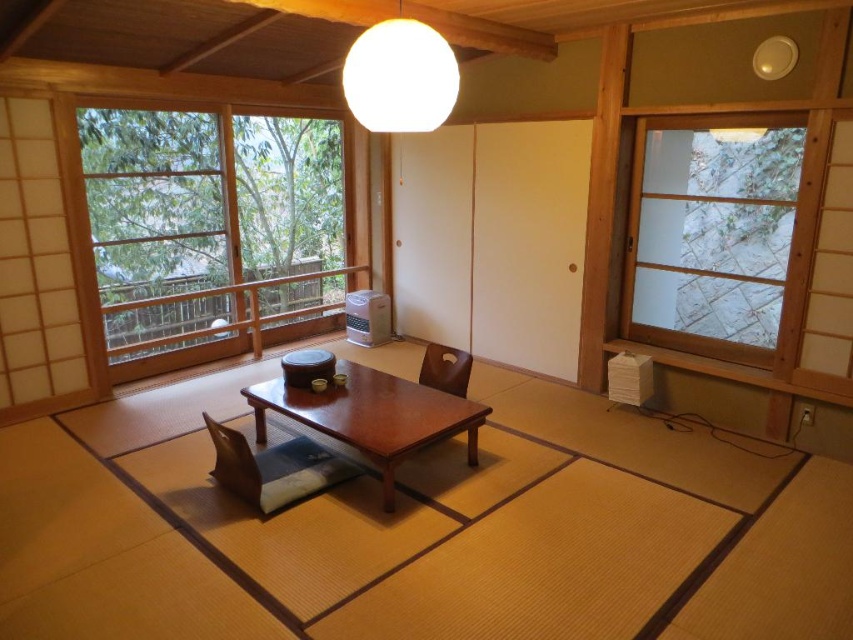
Question: Which of the following is the farthest from the observer?

Choices:
 (A) (430, 33)
 (B) (259, 461)
 (C) (440, 356)

Answer: (C)

Question: Estimate the real-world distances between objects in this image. Which object is farther from the brown matte chair at center?

Choices:
 (A) brown leather chair at center
 (B) wooden chair at center
 (C) brown wooden table at center

Answer: (B)

Question: From the image, what is the correct spatial relationship of wooden chair at center in relation to brown leather chair at center?

Choices:
 (A) below
 (B) above

Answer: (A)

Question: Is brown wooden table at center closer to camera compared to wooden chair at center?

Choices:
 (A) no
 (B) yes

Answer: (B)

Question: Observing the image, what is the correct spatial positioning of transparent glass window at left in reference to brown leather chair at center?

Choices:
 (A) above
 (B) below

Answer: (A)

Question: Based on their relative distances, which object is farther from the transparent glass window at left?

Choices:
 (A) brown wooden table at center
 (B) white matte sphere at upper center
 (C) brown leather chair at center

Answer: (B)